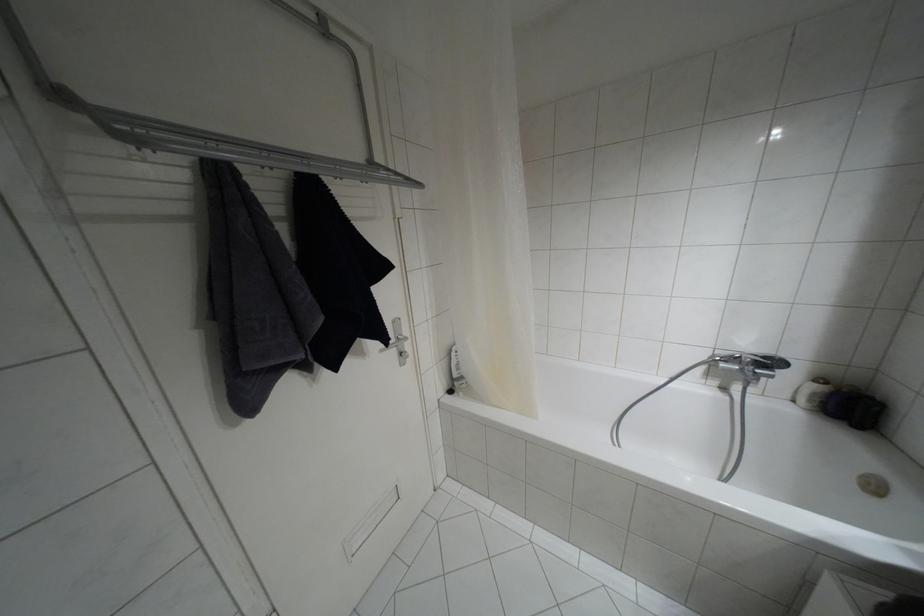
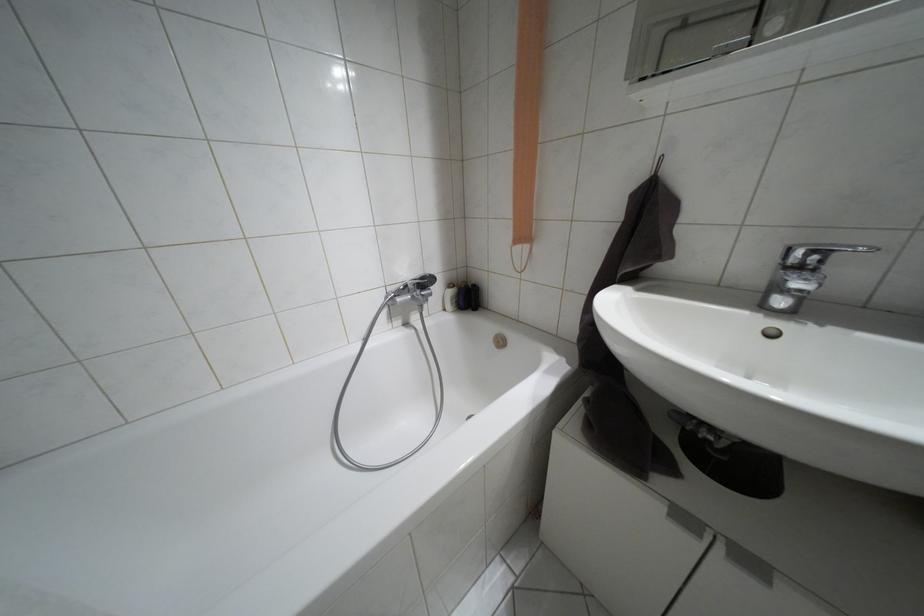
The point at (820, 379) is marked in the first image. Where is the corresponding point in the second image?

(448, 285)